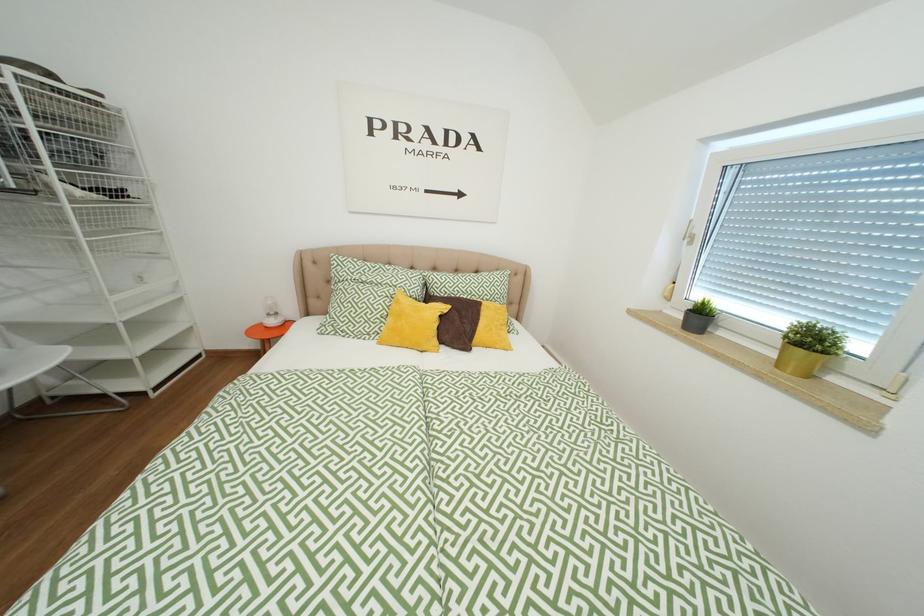
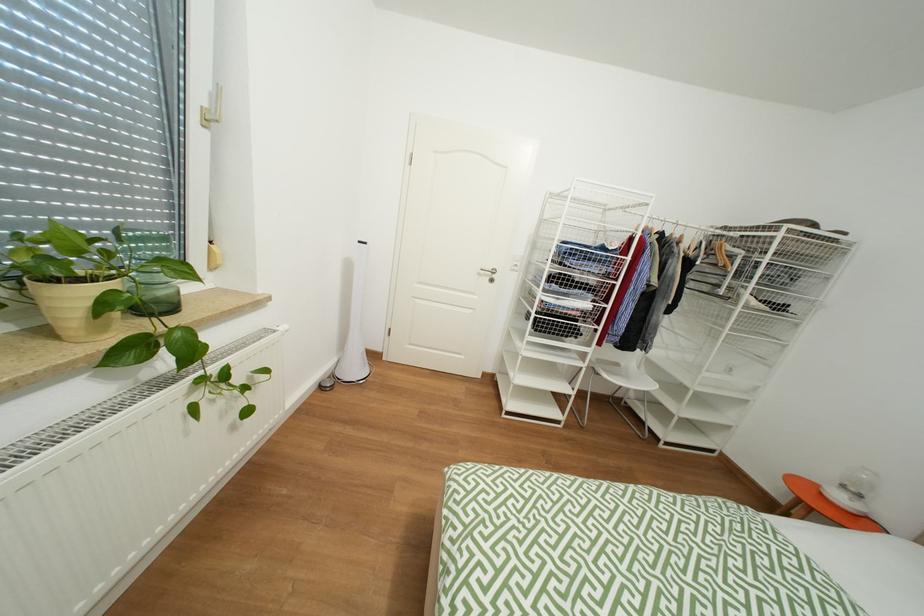
Question: The camera is either moving clockwise (left) or counter-clockwise (right) around the object. The first image is from the beginning of the video and the second image is from the end. Is the camera moving left or right when shooting the video?

Choices:
 (A) Left
 (B) Right

Answer: (B)